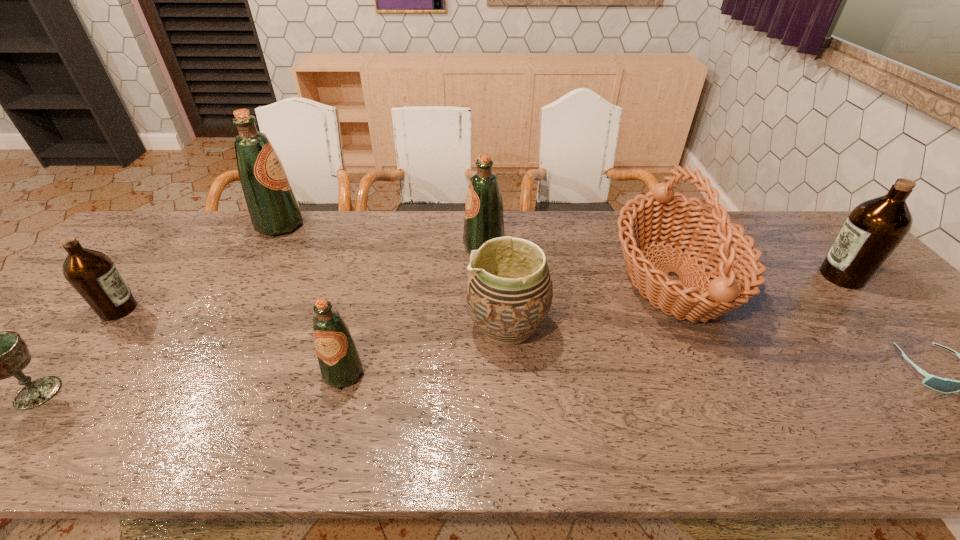
Locate an element on the screen. the tallest olive oil is located at coordinates (274, 210).

This screenshot has width=960, height=540. Identify the location of the seventh object from right to left. (274, 210).

At what (x,y) coordinates should I click in order to perform the action: click on the seventh object from left to right. Please return your answer as a coordinate pair (x, y). The height and width of the screenshot is (540, 960). Looking at the image, I should click on (671, 216).

What are the coordinates of `basket` in the screenshot? It's located at (671, 216).

Identify the location of the second olive oil from right to left. Image resolution: width=960 pixels, height=540 pixels. (484, 221).

Where is `the second biggest green olive oil`? the second biggest green olive oil is located at coordinates (484, 221).

Identify the location of the right brown olive oil. The height and width of the screenshot is (540, 960). (873, 230).

Identify the location of the rightmost olive oil. (873, 230).

You are a GUI agent. You are given a task and a screenshot of the screen. Output one action in this format:
    pyautogui.click(x=<x>, y=<y>)
    Task: Click on the pottery
    
    Given the screenshot: What is the action you would take?
    pyautogui.click(x=509, y=290)

Identify the location of the second green olive oil from left to right. (339, 360).